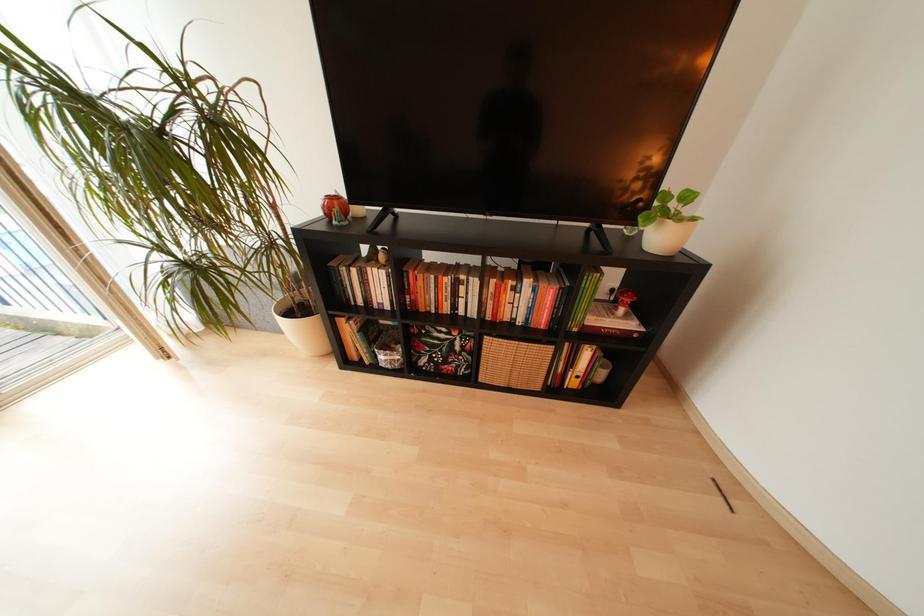
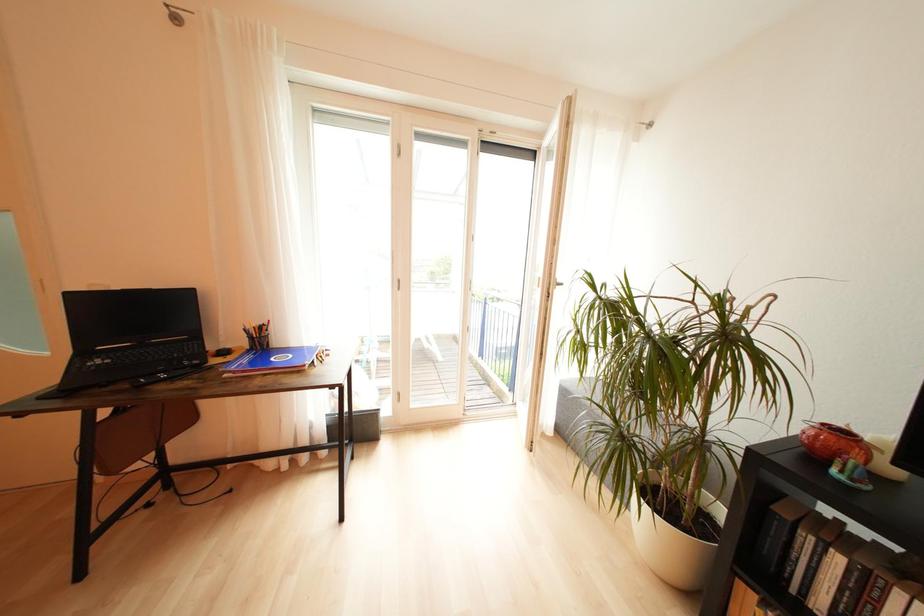
Question: Based on the continuous images, in which direction is the camera rotating? Reply with the corresponding letter.

Choices:
 (A) Left
 (B) Right
 (C) Up
 (D) Down

Answer: (A)